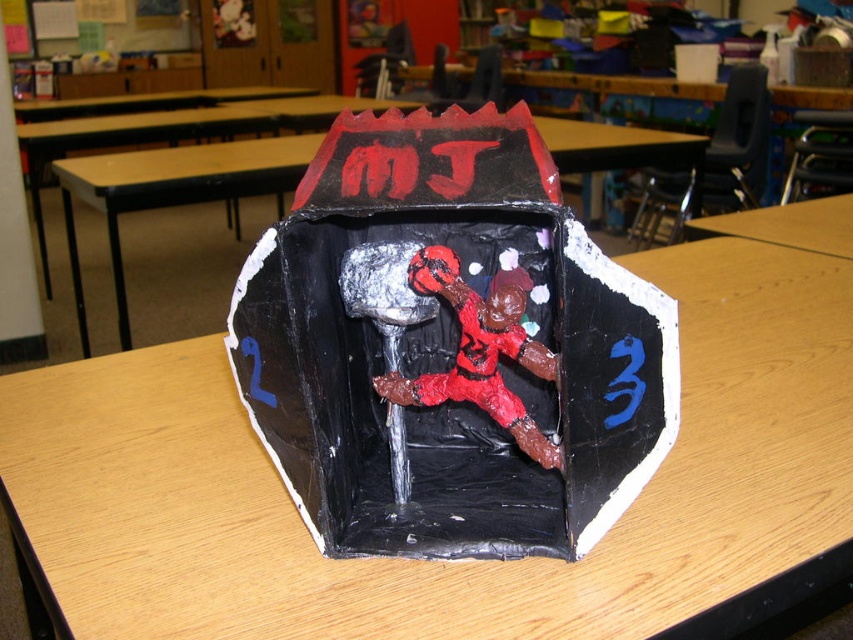
Looking at this image, you are standing in the classroom and want to place a 36 inch long ruler on the wooden table at center. Can you safely place the ruler on the table without it hanging off the edge?

The distance between you and the wooden table at center is 36.66 inches, which is slightly longer than the ruler. Therefore, the ruler can be placed safely on the table without overhanging.

You are organizing a classroom event and need to place a large poster on the table. The poster is 1.2 meters wide. Which table, the wooden table at center or the light brown wood table at center, can accommodate the poster without exceeding its width?

The wooden table at center has a greater width than the light brown wood table at center. Since the poster is 1.2 meters wide, the wooden table at center can accommodate it if its width is sufficient. However, without specific measurements, we can only confirm that the wooden table at center is wider than the light brown wood table at center.

You are a teacher trying to place a heavy textbook on the wooden table at center and the light brown wood table at center. Which table should you choose to ensure the textbook doesn not fall off?

The wooden table at center is positioned under light brown wood table at center, so placing the textbook on the light brown wood table at center would prevent it from falling off as it is the upper table.